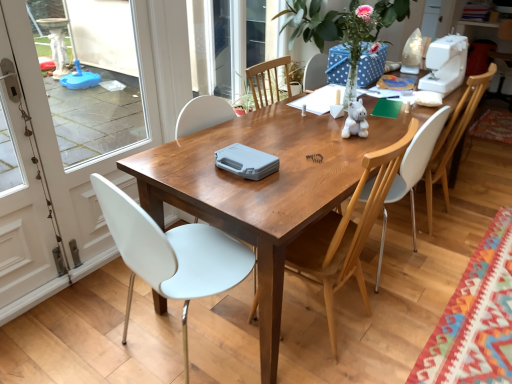
Question: From the image's perspective, is white glossy screen door at left, which ranks as the 1th screen door in left-to-right order, beneath white plastic chair at center, marked as the second chair in a right-to-left arrangement?

Choices:
 (A) yes
 (B) no

Answer: (B)

Question: Considering the relative sizes of white glossy screen door at left, which ranks as the second screen door in right-to-left order, and white plastic chair at center, the third chair when ordered from left to right, in the image provided, is white glossy screen door at left, which ranks as the second screen door in right-to-left order, smaller than white plastic chair at center, the third chair when ordered from left to right,?

Choices:
 (A) yes
 (B) no

Answer: (A)

Question: Is white glossy screen door at left, which ranks as the second screen door in right-to-left order, at the right side of white plastic chair at center, marked as the second chair in a right-to-left arrangement?

Choices:
 (A) no
 (B) yes

Answer: (A)

Question: Is white glossy screen door at left, which ranks as the second screen door in right-to-left order, turned away from white plastic chair at center, marked as the second chair in a right-to-left arrangement?

Choices:
 (A) no
 (B) yes

Answer: (A)

Question: From a real-world perspective, does white glossy screen door at left, which ranks as the second screen door in right-to-left order, sit lower than white plastic chair at center, the third chair when ordered from left to right?

Choices:
 (A) no
 (B) yes

Answer: (A)

Question: From the image's perspective, relative to wooden chair at center, the third chair viewed from the right, is white plastic chair at left, acting as the 1th chair starting from the left, above or below?

Choices:
 (A) above
 (B) below

Answer: (B)

Question: Is white plastic chair at left, acting as the 1th chair starting from the left, situated inside wooden chair at center, the second chair viewed from the left, or outside?

Choices:
 (A) inside
 (B) outside

Answer: (B)

Question: Is point (184, 276) closer or farther from the camera than point (309, 261)?

Choices:
 (A) closer
 (B) farther

Answer: (A)

Question: Looking at the image, does white plastic chair at left, acting as the 1th chair starting from the left, seem bigger or smaller compared to wooden chair at center, the third chair viewed from the right?

Choices:
 (A) big
 (B) small

Answer: (A)

Question: From a real-world perspective, is white glossy screen door at left, the second screen door in the left-to-right sequence, physically located above or below white plastic chair at center, the third chair when ordered from left to right?

Choices:
 (A) above
 (B) below

Answer: (A)

Question: Is white glossy screen door at left, which ranks as the first screen door in right-to-left order, in front of or behind white plastic chair at center, the third chair when ordered from left to right, in the image?

Choices:
 (A) front
 (B) behind

Answer: (A)

Question: Considering the positions of point (11, 33) and point (403, 188), is point (11, 33) closer or farther from the camera than point (403, 188)?

Choices:
 (A) closer
 (B) farther

Answer: (A)

Question: From the image's perspective, is white glossy screen door at left, which ranks as the first screen door in right-to-left order, located above or below white plastic chair at center, the third chair when ordered from left to right?

Choices:
 (A) above
 (B) below

Answer: (A)

Question: In terms of size, does white plastic sewing machine at upper right appear bigger or smaller than white glossy screen door at left, which ranks as the 1th screen door in left-to-right order?

Choices:
 (A) big
 (B) small

Answer: (B)

Question: Based on their positions, is white plastic sewing machine at upper right located to the left or right of white glossy screen door at left, which ranks as the 1th screen door in left-to-right order?

Choices:
 (A) right
 (B) left

Answer: (A)